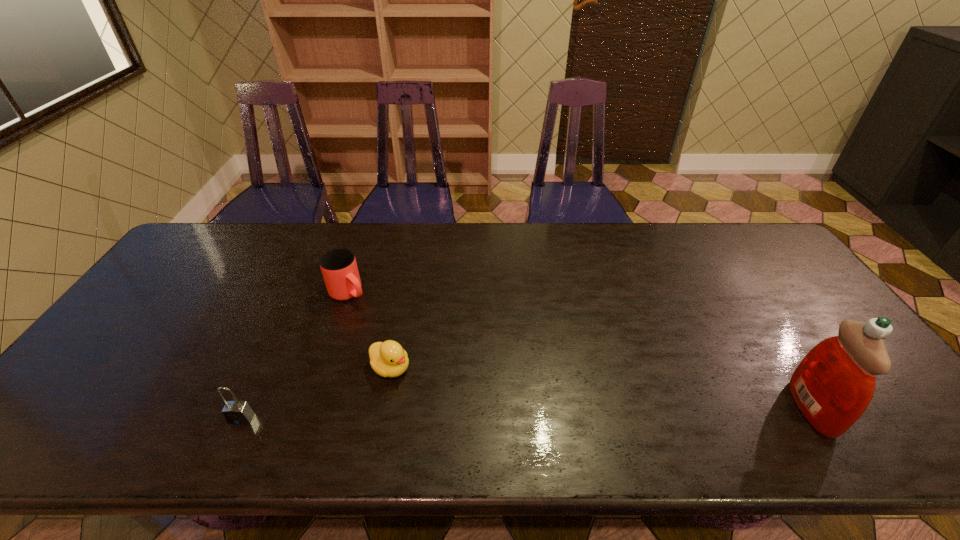
Locate an element on the screen. This screenshot has width=960, height=540. free space on the desktop that is between the leftmost object and the detergent and is positioned on the handle side of the second object from left to right is located at coordinates click(493, 414).

The height and width of the screenshot is (540, 960). I want to click on free spot on the desktop that is between the padlock and the detergent and is positioned on the beak of the shortest object, so click(x=458, y=415).